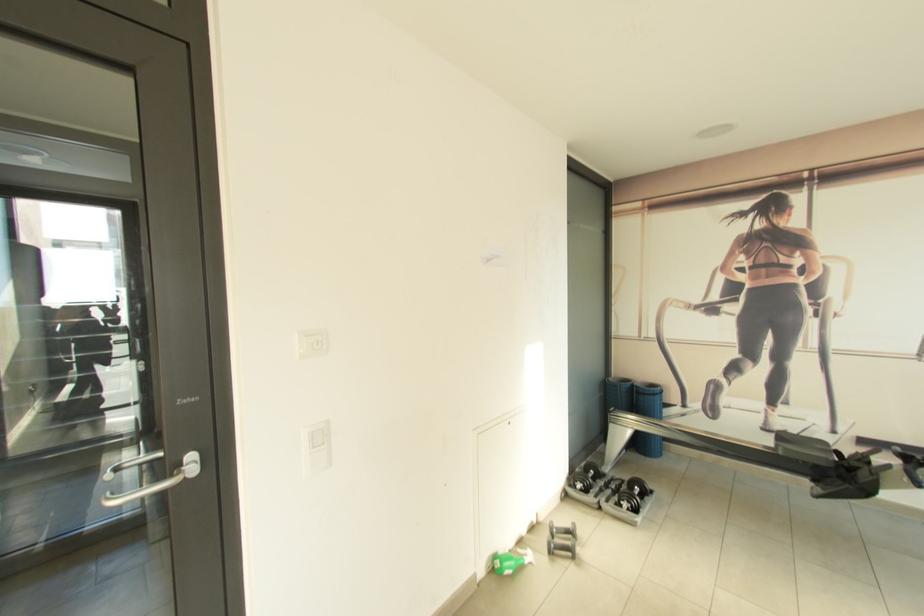
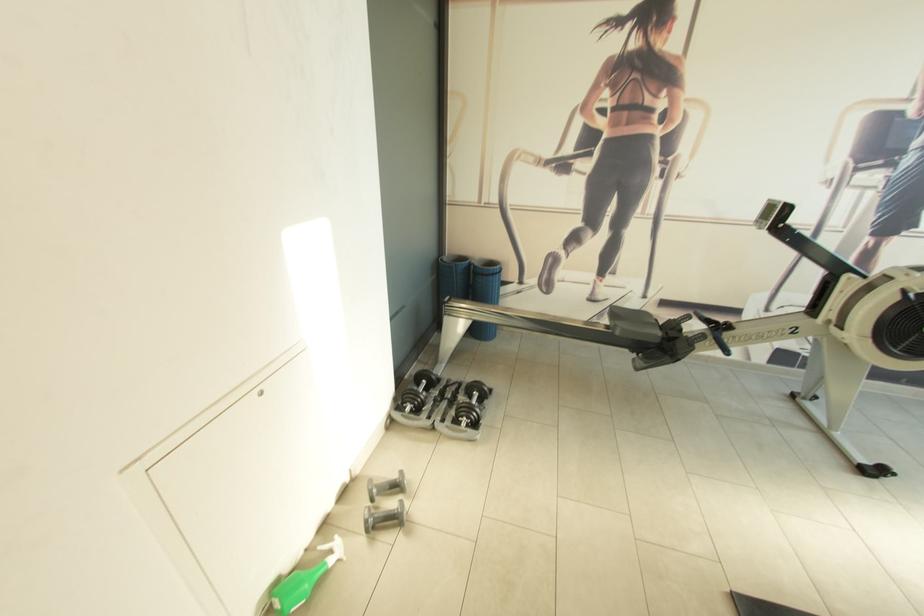
Where in the second image is the point corresponding to point 634,503 from the first image?

(472, 419)